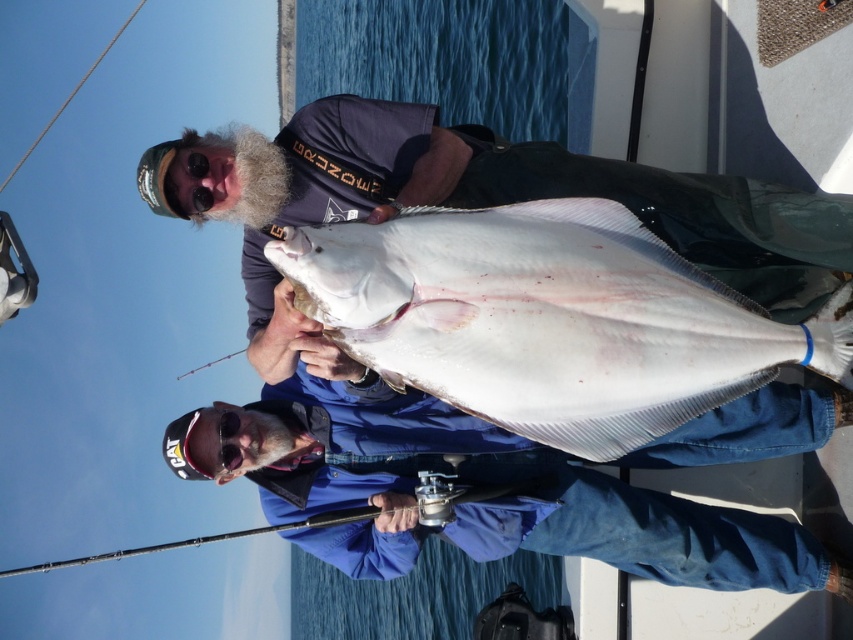
Is white smooth fish at center above white matte fish at center?

Actually, white smooth fish at center is below white matte fish at center.

Which of these two, white smooth fish at center or white matte fish at center, stands shorter?

Standing shorter between the two is white smooth fish at center.

Between point (509, 339) and point (164, 200), which one is positioned behind?

The point (164, 200) is behind.

What are the coordinates of `white smooth fish at center` in the screenshot? It's located at (549, 320).

Does white smooth fish at center appear under smooth black rod at center?

No.

Does white smooth fish at center have a greater height compared to smooth black rod at center?

No.

Is point (488, 248) closer to viewer compared to point (329, 518)?

Yes.

Locate an element on the screen. white smooth fish at center is located at coordinates (549, 320).

Is white matte fish at center in front of smooth black rod at center?

Yes, white matte fish at center is in front of smooth black rod at center.

Can you confirm if white matte fish at center is positioned to the right of smooth black rod at center?

Yes, white matte fish at center is to the right of smooth black rod at center.

The image size is (853, 640). I want to click on white matte fish at center, so click(x=465, y=205).

Locate an element on the screen. The width and height of the screenshot is (853, 640). white matte fish at center is located at coordinates (465, 205).